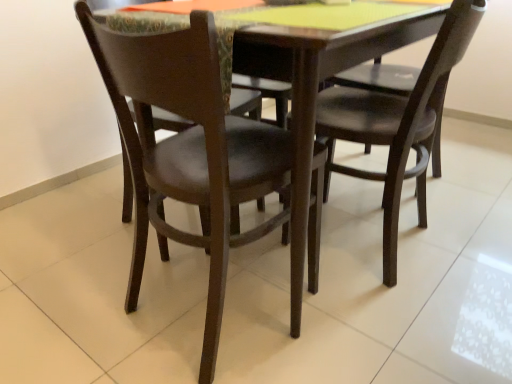
Question: From their relative heights in the image, would you say matte dark brown chair at center, arranged as the 2th chair when viewed from the right, is taller or shorter than matte black chair at center, the first chair in the right-to-left sequence?

Choices:
 (A) short
 (B) tall

Answer: (B)

Question: Is matte dark brown chair at center, arranged as the 2th chair when viewed from the right, bigger or smaller than matte black chair at center, the first chair in the right-to-left sequence?

Choices:
 (A) big
 (B) small

Answer: (B)

Question: Does point (209, 226) appear closer or farther from the camera than point (414, 87)?

Choices:
 (A) farther
 (B) closer

Answer: (B)

Question: From a real-world perspective, is matte black chair at center, which ranks as the second chair in left-to-right order, positioned above or below matte dark brown chair at center, arranged as the 2th chair when viewed from the right?

Choices:
 (A) above
 (B) below

Answer: (A)

Question: Is matte black chair at center, the first chair in the right-to-left sequence, taller or shorter than matte dark brown chair at center, arranged as the 2th chair when viewed from the right?

Choices:
 (A) short
 (B) tall

Answer: (A)

Question: Looking at the image, does matte black chair at center, which ranks as the second chair in left-to-right order, seem bigger or smaller compared to matte dark brown chair at center, arranged as the 2th chair when viewed from the right?

Choices:
 (A) small
 (B) big

Answer: (B)

Question: Is matte black chair at center, the first chair in the right-to-left sequence, wider or thinner than matte dark brown chair at center, marked as the 1th chair in a left-to-right arrangement?

Choices:
 (A) thin
 (B) wide

Answer: (A)